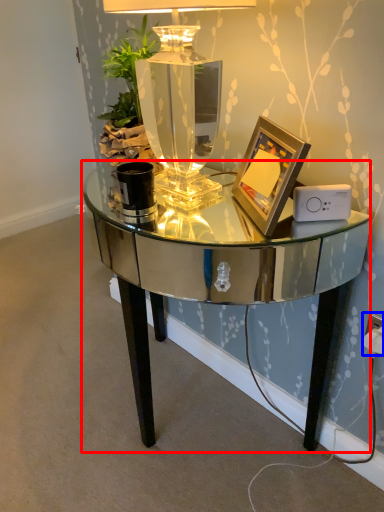
Question: Which of the following is the farthest to the observer, table (highlighted by a red box) or electric outlet (highlighted by a blue box)?

Choices:
 (A) table
 (B) electric outlet

Answer: (B)